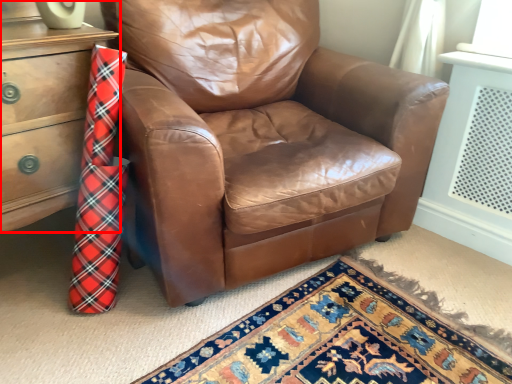
Question: From the image's perspective, where is chest of drawers (annotated by the red box) located in relation to chair in the image?

Choices:
 (A) below
 (B) above

Answer: (A)